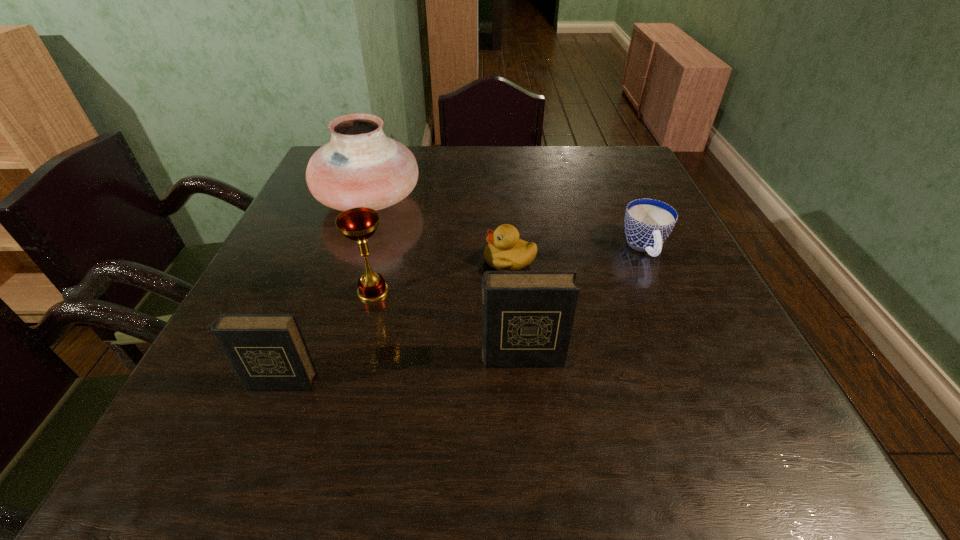
Where is `object that is at the near left corner`? This screenshot has height=540, width=960. object that is at the near left corner is located at coordinates (268, 351).

Where is `blank space at the far edge of the desktop`? The width and height of the screenshot is (960, 540). blank space at the far edge of the desktop is located at coordinates (526, 158).

In the image, there is a desktop. Where is `vacant area at the near edge`? vacant area at the near edge is located at coordinates (314, 405).

At what (x,y) coordinates should I click in order to perform the action: click on vacant area at the right edge of the desktop. Please return your answer as a coordinate pair (x, y). The image size is (960, 540). Looking at the image, I should click on (692, 340).

In the image, there is a desktop. Identify the location of blank space at the near left corner. (221, 384).

This screenshot has height=540, width=960. I want to click on vacant space at the far right corner of the desktop, so click(597, 168).

Image resolution: width=960 pixels, height=540 pixels. In order to click on free space between the taller diary and the fourth farthest object in this screenshot , I will do `click(447, 325)`.

This screenshot has height=540, width=960. Find the location of `unoccupied position between the left diary and the cup`. unoccupied position between the left diary and the cup is located at coordinates (463, 315).

The height and width of the screenshot is (540, 960). I want to click on vacant point located between the left diary and the duckling, so click(x=396, y=321).

At what (x,y) coordinates should I click in order to perform the action: click on unoccupied position between the cup and the nearer diary. Please return your answer as a coordinate pair (x, y). This screenshot has width=960, height=540. Looking at the image, I should click on (463, 315).